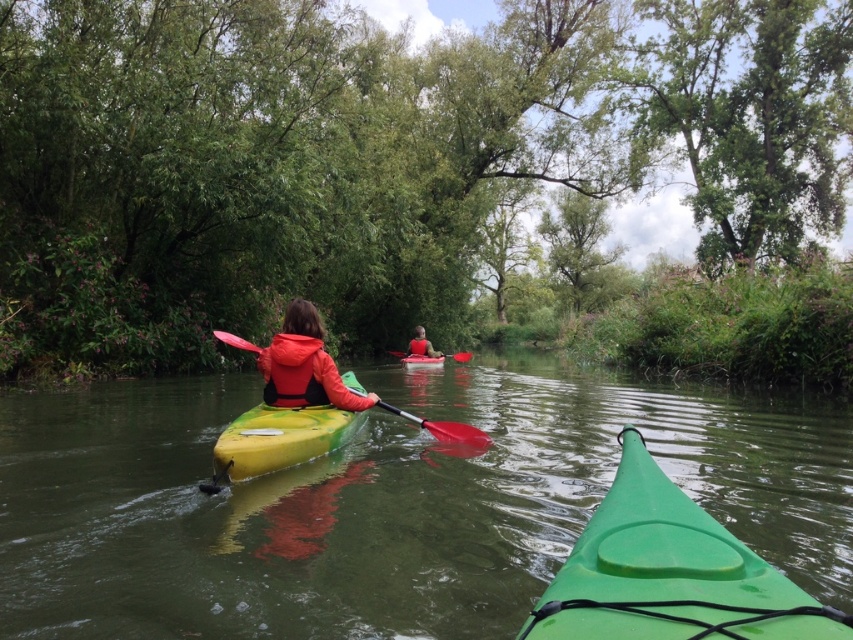
Is green matte canoe at center closer to the viewer compared to red rubber paddle at center?

Yes, it is in front of red rubber paddle at center.

Is the position of green matte canoe at center more distant than that of red rubber paddle at center?

No, green matte canoe at center is closer to the viewer.

Which is in front, point (587, 588) or point (461, 356)?

Point (587, 588)

Find the location of a particular element. This screenshot has width=853, height=640. green matte canoe at center is located at coordinates (669, 572).

Does green matte canoe at center appear on the right side of yellow plastic canoe at center?

Correct, you'll find green matte canoe at center to the right of yellow plastic canoe at center.

The width and height of the screenshot is (853, 640). Describe the element at coordinates (669, 572) in the screenshot. I see `green matte canoe at center` at that location.

Image resolution: width=853 pixels, height=640 pixels. Find the location of `green matte canoe at center`. green matte canoe at center is located at coordinates (669, 572).

Does rubber paddle at center lie in front of yellow plastic canoe at center?

That is True.

Which is behind, point (480, 440) or point (416, 368)?

The point (416, 368) is more distant.

Does point (454, 440) lie in front of point (427, 365)?

Yes.

The image size is (853, 640). Find the location of `rubber paddle at center`. rubber paddle at center is located at coordinates (445, 428).